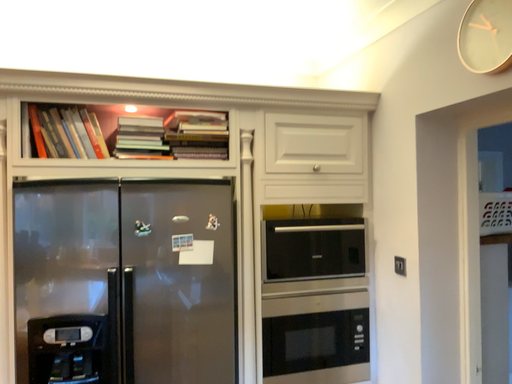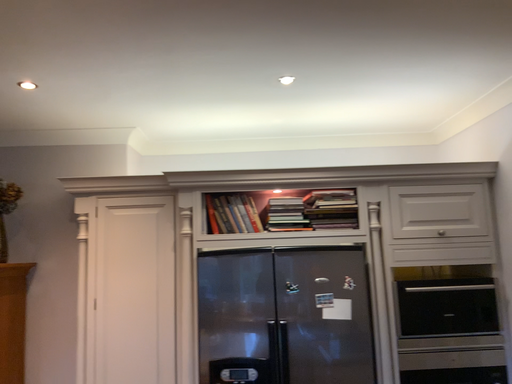
Question: Which way did the camera rotate in the video?

Choices:
 (A) rotated upward
 (B) rotated downward

Answer: (A)